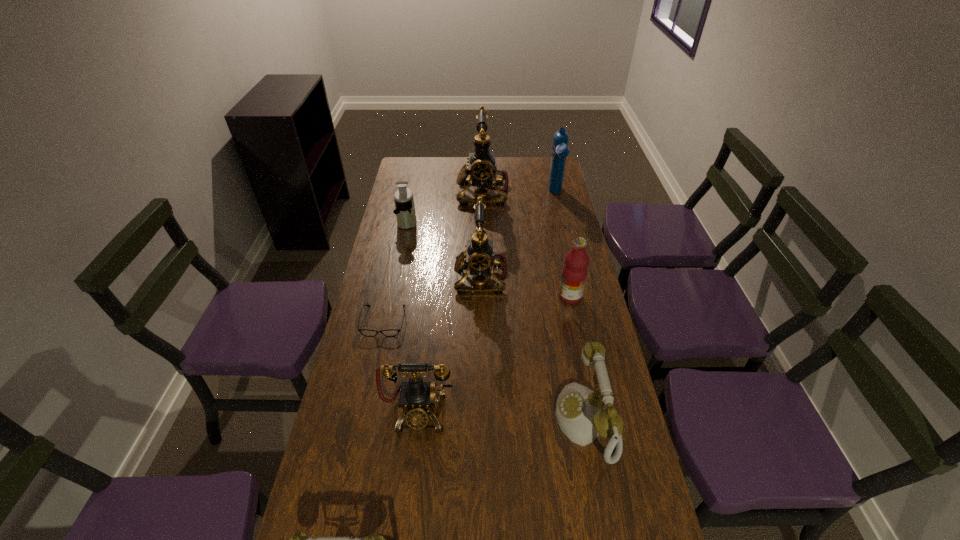
You are a GUI agent. You are given a task and a screenshot of the screen. Output one action in this format:
    pyautogui.click(x=<x>, y=<y>)
    Task: Click on the free space that satisfies the following two spatial constraints: 1. on the front side of the shampoo; 2. on the front of the second biggest black telephone, featuring the rotary dial
    Image resolution: width=960 pixels, height=540 pixels.
    Given the screenshot: What is the action you would take?
    pyautogui.click(x=575, y=276)